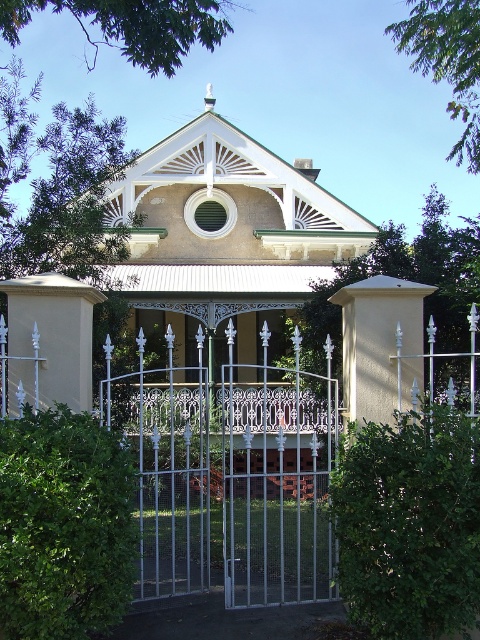
Question: Which point is farther to the camera?

Choices:
 (A) green leafy hedge at lower left
 (B) green leafy hedge at right

Answer: (B)

Question: Which of the following is the farthest from the observer?

Choices:
 (A) green leafy hedge at lower left
 (B) green leafy hedge at right
 (C) white wrought iron gate at center

Answer: (B)

Question: Considering the relative positions of white wrought iron gate at center and green leafy hedge at lower left in the image provided, where is white wrought iron gate at center located with respect to green leafy hedge at lower left?

Choices:
 (A) right
 (B) left

Answer: (A)

Question: Where is white wrought iron gate at center located in relation to green leafy hedge at right in the image?

Choices:
 (A) left
 (B) right

Answer: (A)

Question: Based on their relative distances, which object is farther from the green leafy hedge at right?

Choices:
 (A) white wrought iron gate at center
 (B) green leafy hedge at lower left

Answer: (A)

Question: Does white wrought iron gate at center appear over green leafy hedge at lower left?

Choices:
 (A) no
 (B) yes

Answer: (A)